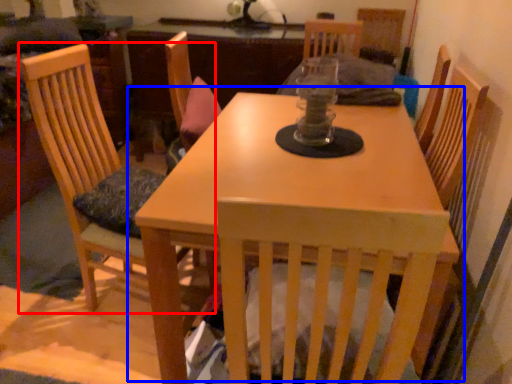
Question: Which of the following is the closest to the observer, chair (highlighted by a red box) or table (highlighted by a blue box)?

Choices:
 (A) chair
 (B) table

Answer: (B)